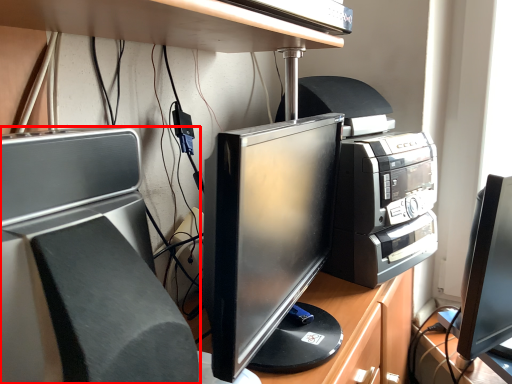
Question: From the image, what is the correct spatial relationship of home appliance (annotated by the red box) in relation to desk?

Choices:
 (A) left
 (B) right

Answer: (A)